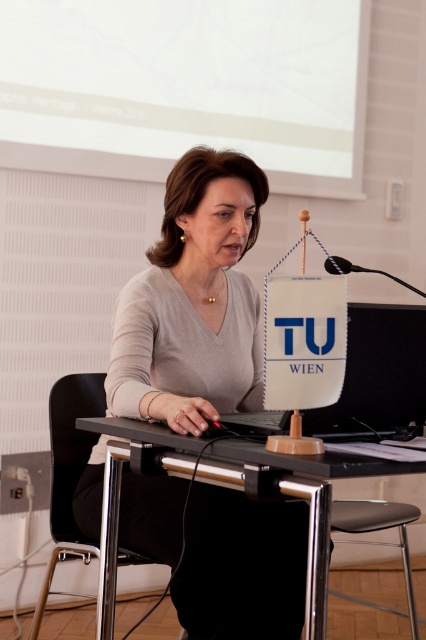
Who is lower down, matte gray sweater at center or black plastic chair at center?

black plastic chair at center

This screenshot has width=426, height=640. What do you see at coordinates (192, 301) in the screenshot?
I see `matte gray sweater at center` at bounding box center [192, 301].

What do you see at coordinates (192, 301) in the screenshot? The image size is (426, 640). I see `matte gray sweater at center` at bounding box center [192, 301].

Where is `matte gray sweater at center`? The image size is (426, 640). matte gray sweater at center is located at coordinates (192, 301).

Identify the location of matte gray sweater at center. This screenshot has height=640, width=426. (192, 301).

Can you confirm if matte gray sweater at center is positioned above black plastic table at center?

Yes.

Between point (235, 561) and point (319, 456), which one is positioned behind?

The point (235, 561) is behind.

Locate an element on the screen. This screenshot has height=640, width=426. matte gray sweater at center is located at coordinates (192, 301).

From the picture: Does white matte projection screen at upper center have a lesser height compared to black plastic table at center?

No.

Which is behind, point (287, 67) or point (212, 456)?

Positioned behind is point (287, 67).

You are a GUI agent. You are given a task and a screenshot of the screen. Output one action in this format:
    pyautogui.click(x=<x>, y=<y>)
    Task: Click on the white matte projection screen at upper center
    The image size is (426, 640).
    Given the screenshot: What is the action you would take?
    pyautogui.click(x=187, y=86)